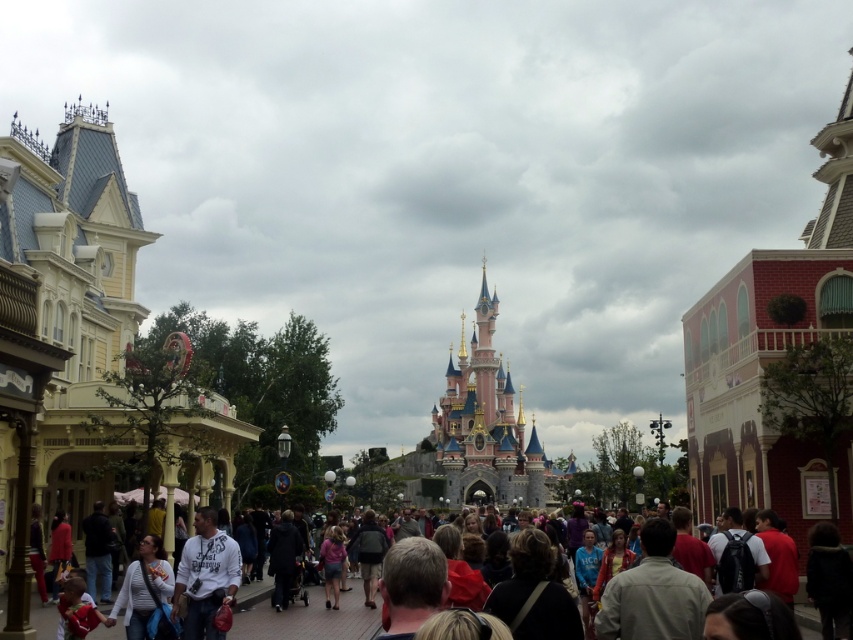
You are a visitor at the theme park and you see a matte black backpack at center and a matte black jacket at lower left. Which item is positioned lower in the image?

The matte black backpack at center is located below the matte black jacket at lower left, so it is positioned lower in the image.

You are a photographer standing at the center of the theme park pathway. You see the matte black backpack at center and the matte black jacket at lower left. Which object is closer to your camera lens?

The matte black backpack at center is closer to your camera lens because it is further to the viewer than the matte black jacket at lower left.

You are standing at the center of the theme park pathway. You see a white cotton shirt at lower left. If you want to reach the shirt, should you walk towards the left or right side of the pathway?

Since the white cotton shirt at lower left is located at point 0.919 on the x and 0.168 on the y, you should walk towards the left side of the pathway to reach it.